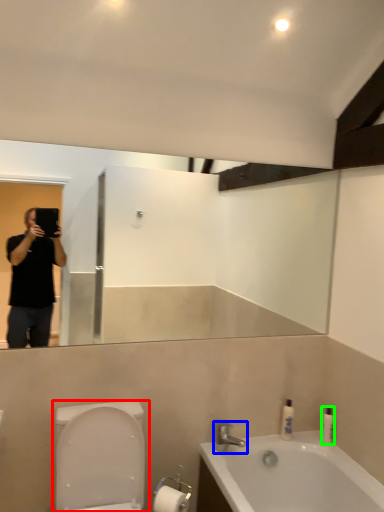
Question: Considering the real-world distances, which object is farthest from toilet (highlighted by a red box)? tap (highlighted by a blue box) or toiletry (highlighted by a green box)?

Choices:
 (A) tap
 (B) toiletry

Answer: (B)